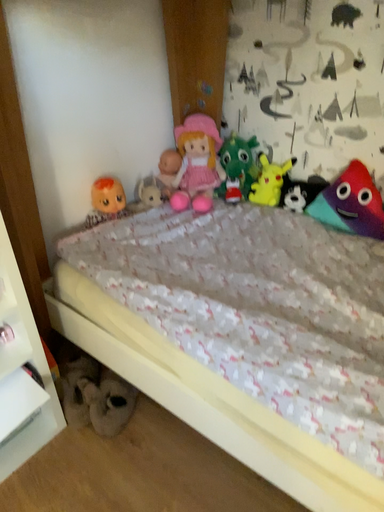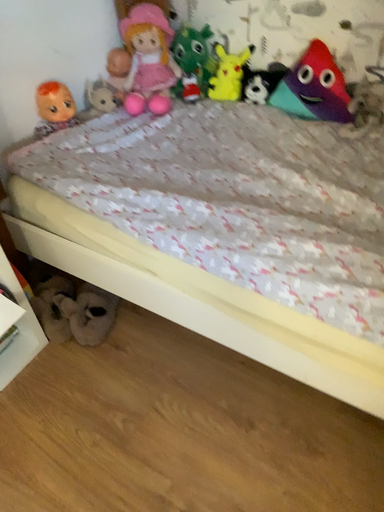
Question: Which way did the camera rotate in the video?

Choices:
 (A) rotated upward
 (B) rotated downward

Answer: (B)